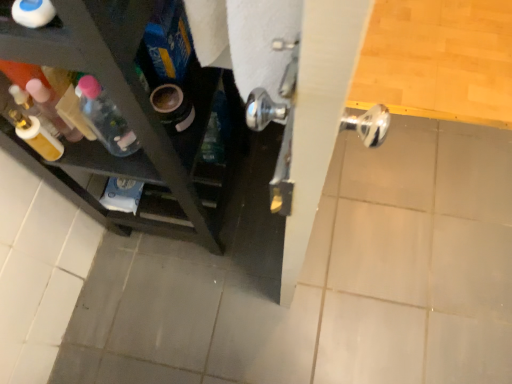
Describe the element at coordinates (33, 13) in the screenshot. I see `white glossy bottle at upper left, the 1th bottle viewed from the right` at that location.

Locate an element on the screen. The width and height of the screenshot is (512, 384). white glossy bottle at upper left, which ranks as the third bottle in back-to-front order is located at coordinates [x=33, y=13].

In order to click on bottle that is the 1st one below the white glossy bottle at upper left, which ranks as the third bottle in back-to-front order (from a real-world perspective) in this screenshot , I will do `click(51, 108)`.

From a real-world perspective, is translucent plastic bottle at left, the 2th bottle when ordered from back to front, physically above white glossy bottle at upper left, placed as the third bottle when sorted from left to right?

No, from a real-world perspective, translucent plastic bottle at left, the 2th bottle when ordered from back to front, is not above white glossy bottle at upper left, placed as the third bottle when sorted from left to right.

Looking at this image, considering the relative positions of translucent plastic bottle at left, the 3th bottle viewed from the right, and white glossy bottle at upper left, the 1th bottle viewed from the right, in the image provided, is translucent plastic bottle at left, the 3th bottle viewed from the right, behind white glossy bottle at upper left, the 1th bottle viewed from the right,?

Yes, translucent plastic bottle at left, the 3th bottle viewed from the right, is behind white glossy bottle at upper left, the 1th bottle viewed from the right.

Considering the points (41, 82) and (28, 0), which point is in front, point (41, 82) or point (28, 0)?

The point (28, 0) is more forward.

Is the depth of white glossy bottle at upper left, the 1th bottle viewed from the right, less than that of translucent plastic bottle at left, the 3th bottle viewed from the right?

That is True.

Is white glossy bottle at upper left, acting as the first bottle starting from the front, thinner than translucent plastic bottle at left, the 2th bottle in the front-to-back sequence?

Yes.

From a real-world perspective, who is located higher, white glossy bottle at upper left, acting as the first bottle starting from the front, or translucent plastic bottle at left, arranged as the 1th bottle when viewed from the left?

white glossy bottle at upper left, acting as the first bottle starting from the front, from a real-world perspective.

How different are the orientations of white glossy bottle at upper left, which ranks as the third bottle in back-to-front order, and translucent plastic bottle at left, the 2th bottle when ordered from back to front, in degrees?

The angle between the facing direction of white glossy bottle at upper left, which ranks as the third bottle in back-to-front order, and the facing direction of translucent plastic bottle at left, the 2th bottle when ordered from back to front, is 5.42 degrees.

Do you think translucent plastic bottle at left, the 2th bottle when ordered from back to front, is within translucent plastic bottle at left, the 2th bottle when ordered from right to left, or outside of it?

translucent plastic bottle at left, the 2th bottle when ordered from back to front, is located beyond the bounds of translucent plastic bottle at left, the 2th bottle when ordered from right to left.

Between point (42, 104) and point (102, 97), which one is positioned behind?

Point (42, 104)

Is translucent plastic bottle at left, the 2th bottle when ordered from back to front, at the left side of translucent plastic bottle at left, which is the first bottle from back to front?

Correct, you'll find translucent plastic bottle at left, the 2th bottle when ordered from back to front, to the left of translucent plastic bottle at left, which is the first bottle from back to front.

Based on the photo, in terms of size, does translucent plastic bottle at left, the 3th bottle viewed from the right, appear bigger or smaller than translucent plastic bottle at left, which is the 3th bottle in front-to-back order?

In the image, translucent plastic bottle at left, the 3th bottle viewed from the right, appears to be larger than translucent plastic bottle at left, which is the 3th bottle in front-to-back order.

Would you say white glossy bottle at upper left, placed as the third bottle when sorted from left to right, is part of translucent plastic bottle at left, which is the 3th bottle in front-to-back order,'s contents?

No.

Can you confirm if translucent plastic bottle at left, which is the first bottle from back to front, is positioned to the left of white glossy bottle at upper left, placed as the third bottle when sorted from left to right?

Yes, translucent plastic bottle at left, which is the first bottle from back to front, is to the left of white glossy bottle at upper left, placed as the third bottle when sorted from left to right.

Is translucent plastic bottle at left, which is the 3th bottle in front-to-back order, turned away from white glossy bottle at upper left, which ranks as the third bottle in back-to-front order?

No, translucent plastic bottle at left, which is the 3th bottle in front-to-back order, is not facing away from white glossy bottle at upper left, which ranks as the third bottle in back-to-front order.

From the picture: From the image's perspective, which is above, translucent plastic bottle at left, which ranks as the 2th bottle in left-to-right order, or white glossy bottle at upper left, placed as the third bottle when sorted from left to right?

white glossy bottle at upper left, placed as the third bottle when sorted from left to right.

Based on the photo, considering the relative sizes of white glossy bottle at upper left, the 1th bottle viewed from the right, and translucent plastic bottle at left, which is the 3th bottle in front-to-back order, in the image provided, is white glossy bottle at upper left, the 1th bottle viewed from the right, thinner than translucent plastic bottle at left, which is the 3th bottle in front-to-back order,?

Correct, the width of white glossy bottle at upper left, the 1th bottle viewed from the right, is less than that of translucent plastic bottle at left, which is the 3th bottle in front-to-back order.

From the image's perspective, is white glossy bottle at upper left, acting as the first bottle starting from the front, beneath translucent plastic bottle at left, which is the 3th bottle in front-to-back order?

Answer: No, from the image's perspective, white glossy bottle at upper left, acting as the first bottle starting from the front, is not beneath translucent plastic bottle at left, which is the 3th bottle in front-to-back order.

Is translucent plastic bottle at left, the 2th bottle when ordered from right to left, far away from translucent plastic bottle at left, arranged as the 1th bottle when viewed from the left?

No, translucent plastic bottle at left, the 2th bottle when ordered from right to left, is not far from translucent plastic bottle at left, arranged as the 1th bottle when viewed from the left.

From the image's perspective, which bottle is the 1st one above the translucent plastic bottle at left, which is the first bottle from back to front? Please provide its 2D coordinates.

[(51, 108)]

Is translucent plastic bottle at left, which is the 3th bottle in front-to-back order, completely or partially outside of translucent plastic bottle at left, the 3th bottle viewed from the right?

Yes, translucent plastic bottle at left, which is the 3th bottle in front-to-back order, is not within translucent plastic bottle at left, the 3th bottle viewed from the right.

At what (x,y) coordinates should I click in order to perform the action: click on the 1st bottle behind the white glossy bottle at upper left, the 1th bottle viewed from the right, starting your count from the anchor. Please return your answer as a coordinate pair (x, y). Looking at the image, I should click on (51, 108).

From the translucent plastic bottle at left, the 3th bottle viewed from the right, count 2nd bottle to the right and point to it. Please provide its 2D coordinates.

[(33, 13)]

Looking at the image, which one is located closer to translucent plastic bottle at left, the 3th bottle viewed from the right, translucent plastic bottle at left, which is the 3th bottle in front-to-back order, or white glossy bottle at upper left, which ranks as the third bottle in back-to-front order?

Based on the image, translucent plastic bottle at left, which is the 3th bottle in front-to-back order, appears to be nearer to translucent plastic bottle at left, the 3th bottle viewed from the right.

Estimate the real-world distances between objects in this image. Which object is further from translucent plastic bottle at left, which ranks as the 2th bottle in left-to-right order, translucent plastic bottle at left, the 2th bottle in the front-to-back sequence, or white glossy bottle at upper left, the 1th bottle viewed from the right?

white glossy bottle at upper left, the 1th bottle viewed from the right, lies further to translucent plastic bottle at left, which ranks as the 2th bottle in left-to-right order, than the other object.

When comparing their distances from translucent plastic bottle at left, the 3th bottle viewed from the right, does white glossy bottle at upper left, which ranks as the third bottle in back-to-front order, or translucent plastic bottle at left, which ranks as the 2th bottle in left-to-right order, seem further?

Among the two, white glossy bottle at upper left, which ranks as the third bottle in back-to-front order, is located further to translucent plastic bottle at left, the 3th bottle viewed from the right.

Looking at the image, which one is located closer to white glossy bottle at upper left, acting as the first bottle starting from the front, translucent plastic bottle at left, which is the 3th bottle in front-to-back order, or translucent plastic bottle at left, arranged as the 1th bottle when viewed from the left?

translucent plastic bottle at left, which is the 3th bottle in front-to-back order, is positioned closer to the anchor white glossy bottle at upper left, acting as the first bottle starting from the front.

Based on their spatial positions, is translucent plastic bottle at left, arranged as the 1th bottle when viewed from the left, or translucent plastic bottle at left, the 2th bottle when ordered from right to left, further from white glossy bottle at upper left, the 1th bottle viewed from the right?

The object further to white glossy bottle at upper left, the 1th bottle viewed from the right, is translucent plastic bottle at left, arranged as the 1th bottle when viewed from the left.

From the image, which object appears to be nearer to translucent plastic bottle at left, which is the 3th bottle in front-to-back order, white glossy bottle at upper left, acting as the first bottle starting from the front, or translucent plastic bottle at left, the 2th bottle in the front-to-back sequence?

translucent plastic bottle at left, the 2th bottle in the front-to-back sequence, lies closer to translucent plastic bottle at left, which is the 3th bottle in front-to-back order, than the other object.

Identify the location of bottle positioned between white glossy bottle at upper left, acting as the first bottle starting from the front, and translucent plastic bottle at left, which ranks as the 2th bottle in left-to-right order, from near to far. The image size is (512, 384). (51, 108).